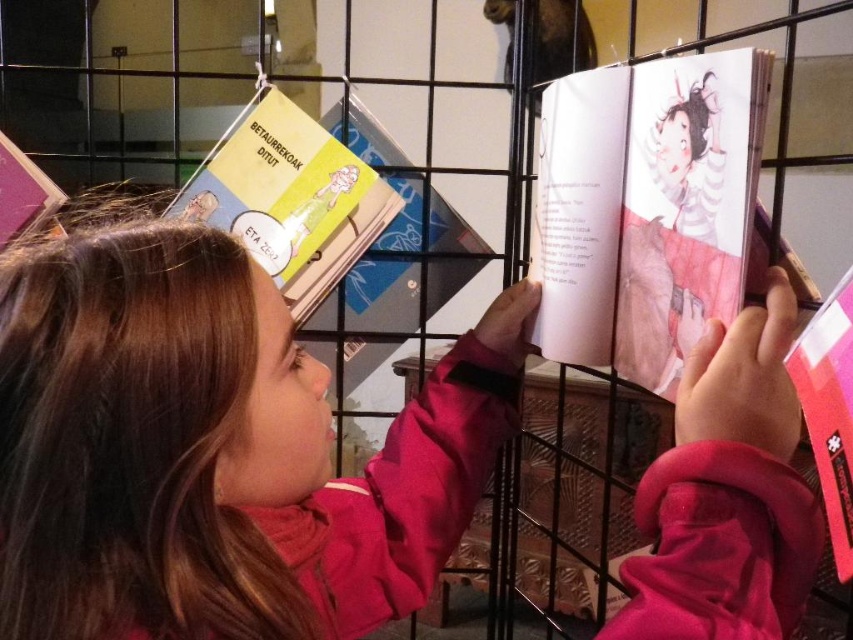
You are a librarian organizing books on a shelf. You have a yellow paper book at upper left and a hardcover book at center. Which book should you place first if you want to arrange them from largest to smallest?

The yellow paper book at upper left is bigger than the hardcover book at center, so you should place the yellow paper book at upper left first when arranging from largest to smallest.

You are a librarian who needs to place both the hardcover book at center and the matte yellow book at upper left on a shelf. Which book should you place first to ensure they both fit on the shelf?

The matte yellow book at upper left should be placed first because the hardcover book at center is wider, so starting with the smaller one allows more space for the larger book to fit properly.